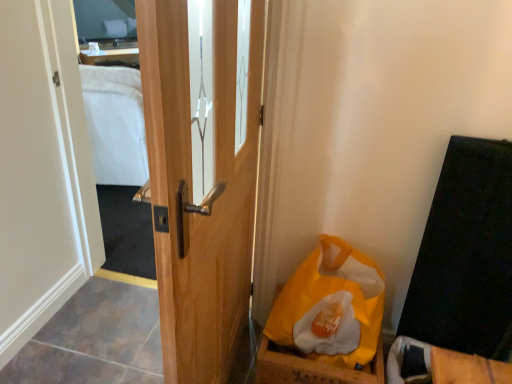
Question: Is clear glass mirror at upper left not near wooden door at center?

Choices:
 (A) yes
 (B) no

Answer: (A)

Question: From the image's perspective, is clear glass mirror at upper left under wooden door at center?

Choices:
 (A) no
 (B) yes

Answer: (A)

Question: Is clear glass mirror at upper left wider than wooden door at center?

Choices:
 (A) no
 (B) yes

Answer: (B)

Question: Does clear glass mirror at upper left have a lesser height compared to wooden door at center?

Choices:
 (A) no
 (B) yes

Answer: (B)

Question: Is clear glass mirror at upper left next to wooden door at center?

Choices:
 (A) yes
 (B) no

Answer: (B)

Question: From the image's perspective, would you say clear glass mirror at upper left is positioned over wooden door at center?

Choices:
 (A) no
 (B) yes

Answer: (B)

Question: From the image's perspective, is yellow paper bag at lower right below clear glass mirror at upper left?

Choices:
 (A) yes
 (B) no

Answer: (A)

Question: Is yellow paper bag at lower right smaller than clear glass mirror at upper left?

Choices:
 (A) yes
 (B) no

Answer: (A)

Question: From the image's perspective, is yellow paper bag at lower right above clear glass mirror at upper left?

Choices:
 (A) yes
 (B) no

Answer: (B)

Question: Would you consider yellow paper bag at lower right to be distant from clear glass mirror at upper left?

Choices:
 (A) yes
 (B) no

Answer: (A)

Question: Is yellow paper bag at lower right at the right side of clear glass mirror at upper left?

Choices:
 (A) yes
 (B) no

Answer: (A)

Question: Can you confirm if yellow paper bag at lower right is positioned to the left of clear glass mirror at upper left?

Choices:
 (A) yes
 (B) no

Answer: (B)

Question: Is yellow paper bag at lower right touching wooden door at center?

Choices:
 (A) no
 (B) yes

Answer: (A)